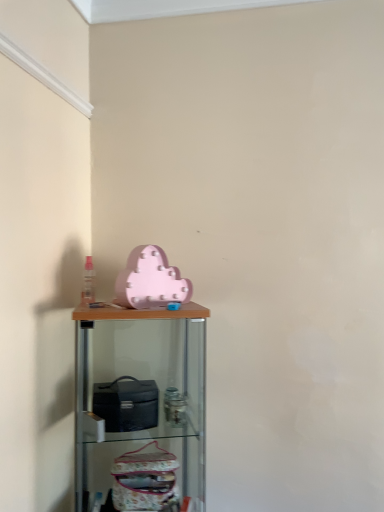
Question: From a real-world perspective, is matte pink cloud at upper center positioned under pink matte cloud at upper center based on gravity?

Choices:
 (A) yes
 (B) no

Answer: (B)

Question: Can you confirm if matte pink cloud at upper center is bigger than pink matte cloud at upper center?

Choices:
 (A) yes
 (B) no

Answer: (B)

Question: From the image's perspective, is matte pink cloud at upper center on pink matte cloud at upper center?

Choices:
 (A) yes
 (B) no

Answer: (A)

Question: Can pink matte cloud at upper center be found inside matte pink cloud at upper center?

Choices:
 (A) no
 (B) yes

Answer: (A)

Question: Is matte pink cloud at upper center taller than pink matte cloud at upper center?

Choices:
 (A) yes
 (B) no

Answer: (B)

Question: Is matte pink cloud at upper center located outside pink matte cloud at upper center?

Choices:
 (A) yes
 (B) no

Answer: (A)

Question: From the image's perspective, is pink matte cloud at upper center located beneath matte pink cloud at upper center?

Choices:
 (A) no
 (B) yes

Answer: (B)

Question: Does pink matte cloud at upper center have a smaller size compared to matte pink cloud at upper center?

Choices:
 (A) no
 (B) yes

Answer: (A)

Question: From the image's perspective, is pink matte cloud at upper center on matte pink cloud at upper center?

Choices:
 (A) no
 (B) yes

Answer: (A)

Question: Does pink matte cloud at upper center have a larger size compared to matte pink cloud at upper center?

Choices:
 (A) yes
 (B) no

Answer: (A)

Question: Can we say pink matte cloud at upper center lies outside matte pink cloud at upper center?

Choices:
 (A) yes
 (B) no

Answer: (A)

Question: Can you confirm if pink matte cloud at upper center is shorter than matte pink cloud at upper center?

Choices:
 (A) yes
 (B) no

Answer: (B)

Question: From the image's perspective, relative to pink matte cloud at upper center, is matte pink cloud at upper center above or below?

Choices:
 (A) below
 (B) above

Answer: (B)